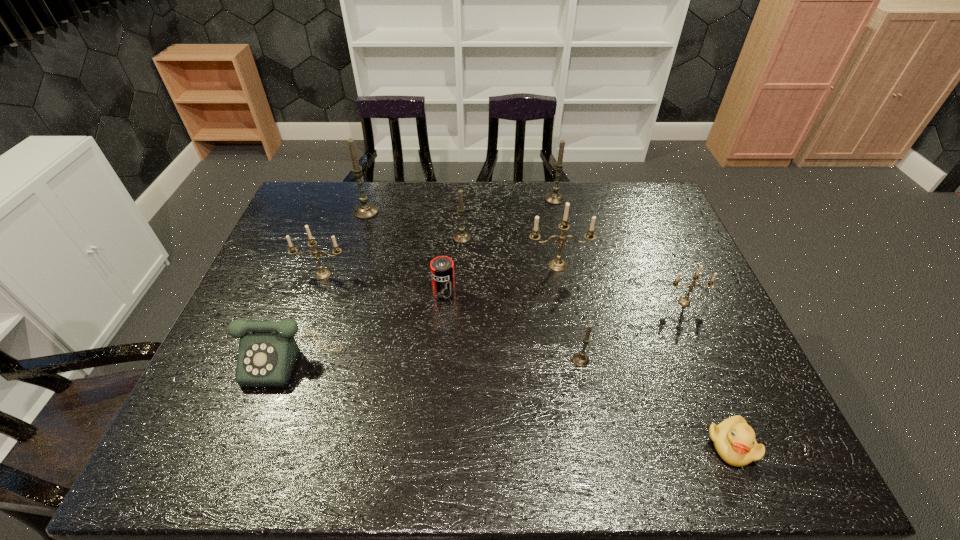
This screenshot has height=540, width=960. In the image, there is a desktop. In order to click on free space at the far edge in this screenshot , I will do `click(518, 216)`.

Identify the location of vacant space at the left edge of the desktop. This screenshot has height=540, width=960. (283, 269).

The width and height of the screenshot is (960, 540). In order to click on vacant space at the right edge in this screenshot , I will do `click(708, 325)`.

At what (x,y) coordinates should I click in order to perform the action: click on vacant region at the far left corner of the desktop. Please return your answer as a coordinate pair (x, y). Looking at the image, I should click on (329, 212).

What are the coordinates of `free spot at the far right corner of the desktop` in the screenshot? It's located at (648, 183).

Identify the location of vacant space that is in between the can and the third smallest gray candle. The height and width of the screenshot is (540, 960). (499, 246).

The width and height of the screenshot is (960, 540). Identify the location of empty space that is in between the nearest object and the third candle from left to right. (596, 341).

In order to click on free space between the third smallest gray candle and the smallest metallic candle in this screenshot , I will do `click(619, 251)`.

Locate an element on the screen. empty space that is in between the nearest object and the sixth farthest candle is located at coordinates (708, 373).

This screenshot has width=960, height=540. In order to click on empty space between the smallest gray candle and the rightmost metallic candle in this screenshot , I will do `click(633, 331)`.